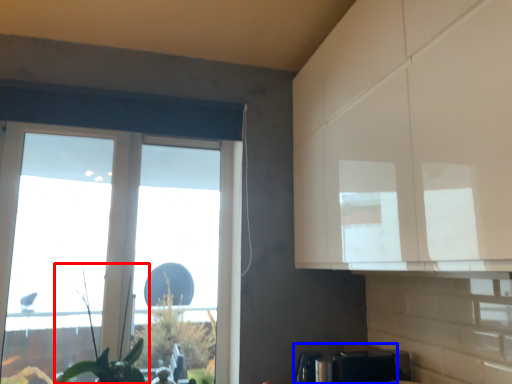
Question: Which of the following is the farthest to the observer, plant (highlighted by a red box) or appliance (highlighted by a blue box)?

Choices:
 (A) plant
 (B) appliance

Answer: (A)